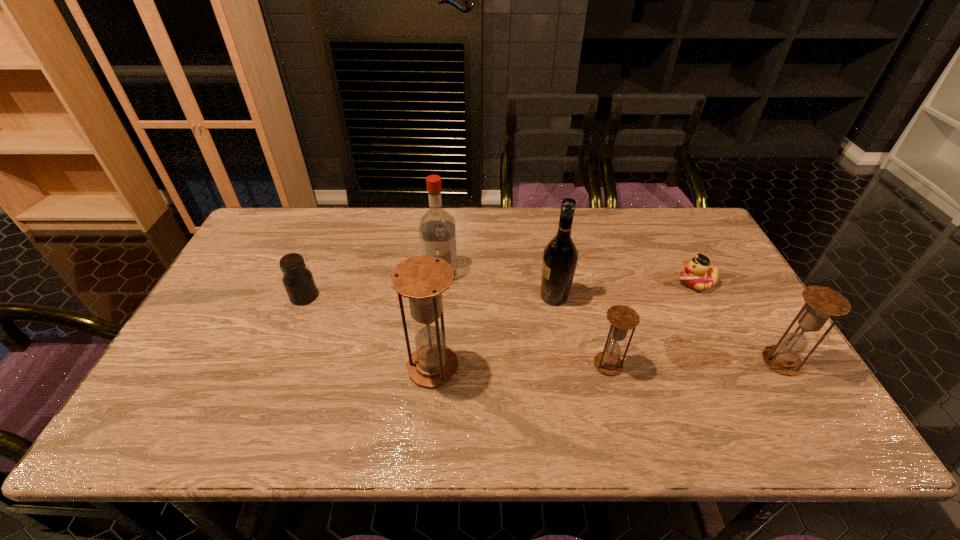
You are a GUI agent. You are given a task and a screenshot of the screen. Output one action in this format:
    pyautogui.click(x=<x>, y=<y>)
    Task: Click on the closest hourglass to the shortest hourglass
    Image resolution: width=960 pixels, height=540 pixels.
    Given the screenshot: What is the action you would take?
    pyautogui.click(x=422, y=279)

Where is `hourglass object that ranks as the second closest to the third object from right to left`? This screenshot has height=540, width=960. hourglass object that ranks as the second closest to the third object from right to left is located at coordinates (822, 302).

Find the location of a particular element. The height and width of the screenshot is (540, 960). free space that satisfies the following two spatial constraints: 1. on the label of the wine bottle; 2. on the front side of the tallest hourglass is located at coordinates (566, 367).

The image size is (960, 540). What are the coordinates of `blank space that satisfies the following two spatial constraints: 1. on the back side of the rightmost object; 2. on the label of the fourth object from left to right` in the screenshot? It's located at (742, 296).

This screenshot has width=960, height=540. What are the coordinates of `vacant space that satisfies the following two spatial constraints: 1. on the front side of the jar; 2. on the right side of the third shortest object` in the screenshot? It's located at (276, 364).

The image size is (960, 540). What are the coordinates of `vacant position in the image that satisfies the following two spatial constraints: 1. on the front-facing side of the leftmost hourglass; 2. on the right side of the liquor` in the screenshot? It's located at (432, 367).

Locate an element on the screen. This screenshot has height=540, width=960. free space that satisfies the following two spatial constraints: 1. on the face of the second object from right to left; 2. on the left side of the fourth tallest object is located at coordinates (736, 361).

This screenshot has width=960, height=540. In order to click on vacant region that satisfies the following two spatial constraints: 1. on the face of the duck; 2. on the front side of the leftmost hourglass in this screenshot , I will do `click(739, 367)`.